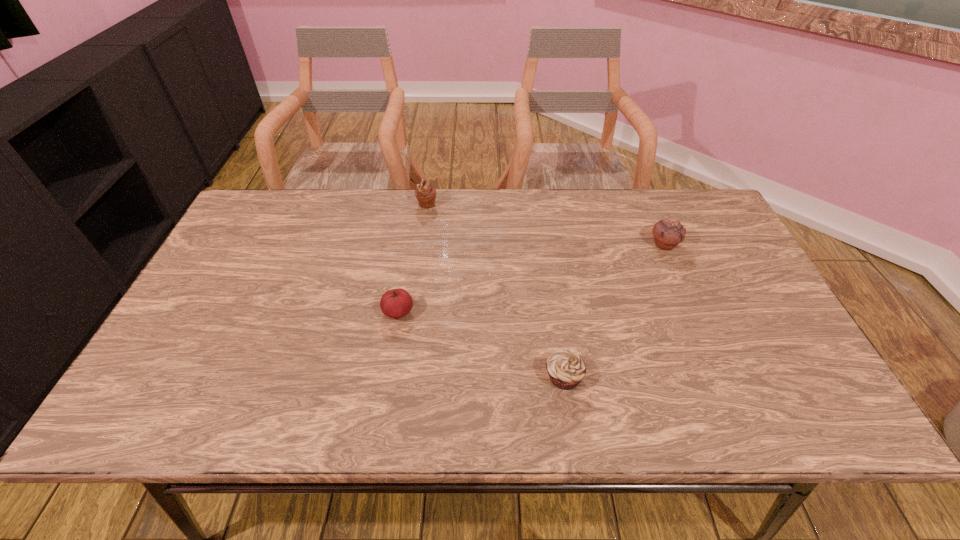
Identify the location of free area in between the nearest muffin and the tomato. (481, 345).

Locate an element on the screen. The width and height of the screenshot is (960, 540). vacant area between the rightmost muffin and the leftmost muffin is located at coordinates (545, 224).

Identify the location of vacant space that is in between the leftmost muffin and the second tallest muffin. (545, 224).

The height and width of the screenshot is (540, 960). Identify the location of free space between the tomato and the third nearest object. (531, 278).

Image resolution: width=960 pixels, height=540 pixels. I want to click on free space between the rightmost muffin and the leftmost muffin, so click(x=545, y=224).

You are a GUI agent. You are given a task and a screenshot of the screen. Output one action in this format:
    pyautogui.click(x=<x>, y=<y>)
    Task: Click on the free spot between the third farthest object and the farthest object
    This screenshot has width=960, height=540.
    Given the screenshot: What is the action you would take?
    pyautogui.click(x=413, y=258)

The width and height of the screenshot is (960, 540). Find the location of `vacant area between the second nearest object and the farthest object`. vacant area between the second nearest object and the farthest object is located at coordinates (413, 258).

This screenshot has width=960, height=540. Identify the location of empty location between the tomato and the third nearest object. (531, 278).

The width and height of the screenshot is (960, 540). I want to click on vacant area that lies between the second shortest muffin and the leftmost muffin, so click(x=545, y=224).

Identify the location of free point between the farthest muffin and the second nearest object. The image size is (960, 540). pyautogui.click(x=413, y=258).